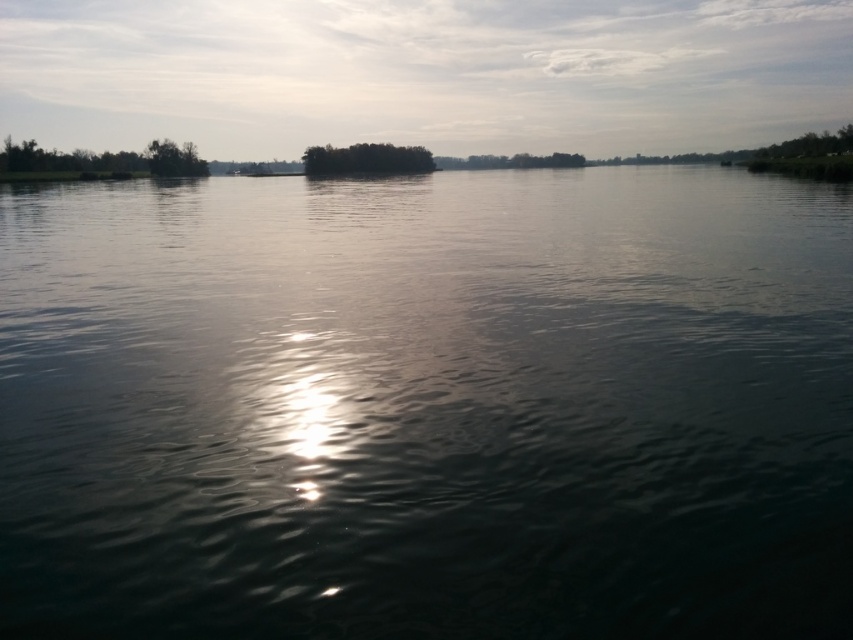
You are an environmental scientist assessing the biodiversity of the area. You observe the green leafy trees at left and the green matte tree at upper left in the image. Which of these two trees has a wider spread of branches and foliage?

The green leafy trees at left has a wider spread of branches and foliage because its width is larger than the green matte tree at upper left.

You are an artist trying to paint this scene. You want to ensure the greenish reflective water at center and the green leafy trees at left are proportionally accurate. Which object should you paint first to maintain the correct size relationship between them?

You should paint the green leafy trees at left first because they are larger than the greenish reflective water at center, allowing you to establish the proper scale before adding the smaller element.